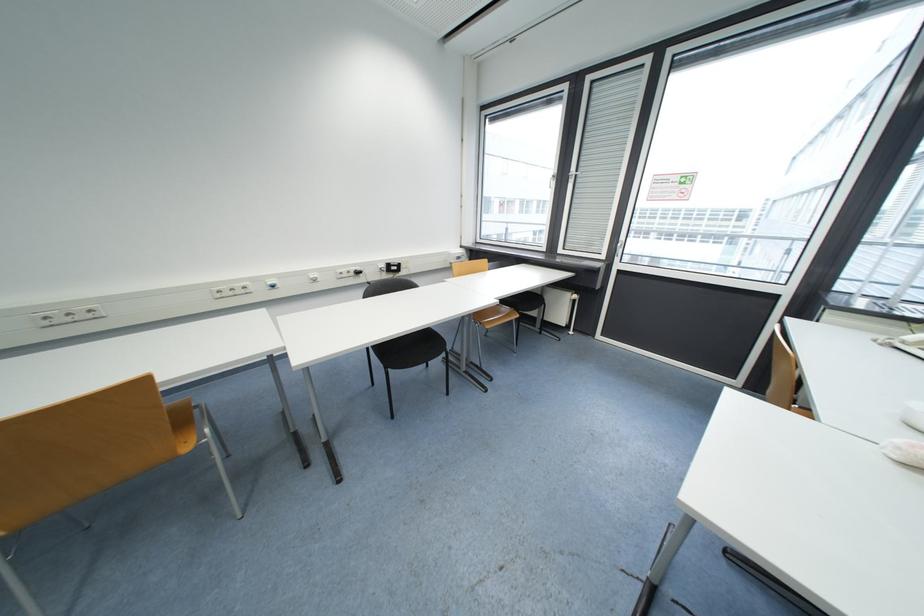
Describe the element at coordinates (618, 246) in the screenshot. The height and width of the screenshot is (616, 924). I see `the silver window handle` at that location.